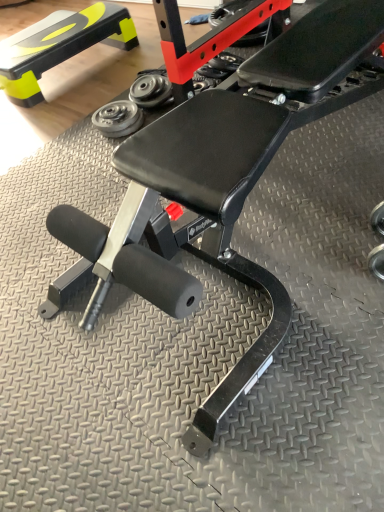
Question: Is silver metallic dumbbell at center, which appears as the second dumbbell when viewed from the top, aimed at matte black step at upper left?

Choices:
 (A) no
 (B) yes

Answer: (A)

Question: From a real-world perspective, is silver metallic dumbbell at center, which appears as the first dumbbell when ordered from the bottom, positioned under matte black step at upper left based on gravity?

Choices:
 (A) yes
 (B) no

Answer: (A)

Question: Can you confirm if silver metallic dumbbell at center, which appears as the second dumbbell when viewed from the top, is positioned to the right of matte black step at upper left?

Choices:
 (A) no
 (B) yes

Answer: (B)

Question: Considering the relative sizes of silver metallic dumbbell at center, which appears as the second dumbbell when viewed from the top, and matte black step at upper left in the image provided, is silver metallic dumbbell at center, which appears as the second dumbbell when viewed from the top, shorter than matte black step at upper left?

Choices:
 (A) yes
 (B) no

Answer: (A)

Question: Considering the relative sizes of silver metallic dumbbell at center, which appears as the first dumbbell when ordered from the bottom, and matte black step at upper left in the image provided, is silver metallic dumbbell at center, which appears as the first dumbbell when ordered from the bottom, wider than matte black step at upper left?

Choices:
 (A) no
 (B) yes

Answer: (A)

Question: From a real-world perspective, is silver metallic dumbbell at center, which appears as the second dumbbell when viewed from the top, over matte black step at upper left?

Choices:
 (A) yes
 (B) no

Answer: (B)

Question: Is matte black step at upper left taller than silver metallic dumbbell at center, which appears as the first dumbbell when ordered from the bottom?

Choices:
 (A) yes
 (B) no

Answer: (A)

Question: From the image's perspective, is matte black step at upper left over silver metallic dumbbell at center, which appears as the second dumbbell when viewed from the top?

Choices:
 (A) yes
 (B) no

Answer: (A)

Question: Is silver metallic dumbbell at center, which appears as the second dumbbell when viewed from the top, a part of matte black step at upper left?

Choices:
 (A) no
 (B) yes

Answer: (A)

Question: From a real-world perspective, is matte black step at upper left physically below silver metallic dumbbell at center, which appears as the first dumbbell when ordered from the bottom?

Choices:
 (A) yes
 (B) no

Answer: (B)

Question: Would you consider matte black step at upper left to be distant from silver metallic dumbbell at center, which appears as the second dumbbell when viewed from the top?

Choices:
 (A) yes
 (B) no

Answer: (B)

Question: From a real-world perspective, is matte black step at upper left located higher than silver metallic dumbbell at center, which appears as the first dumbbell when ordered from the bottom?

Choices:
 (A) yes
 (B) no

Answer: (A)

Question: Does matte black step at upper left have a smaller size compared to metallic silver weight at center, which appears as the 2th dumbbell when ordered from the bottom?

Choices:
 (A) no
 (B) yes

Answer: (A)